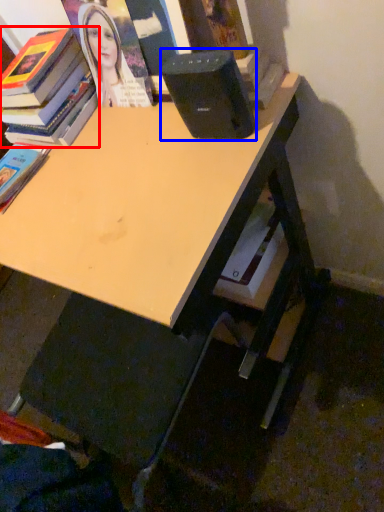
Question: Among these objects, which one is farthest to the camera, book (highlighted by a red box) or speaker (highlighted by a blue box)?

Choices:
 (A) book
 (B) speaker

Answer: (A)